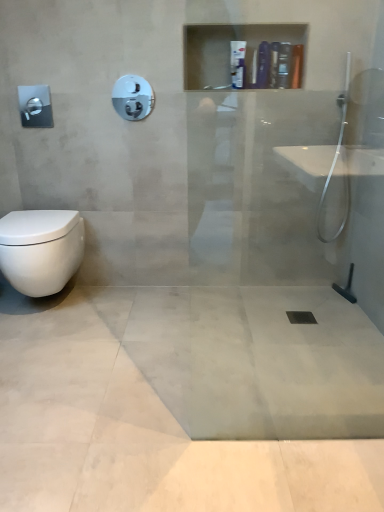
What do you see at coordinates (263, 65) in the screenshot?
I see `matte plastic bottle at upper center, the third toiletry when ordered from left to right` at bounding box center [263, 65].

Image resolution: width=384 pixels, height=512 pixels. What do you see at coordinates (284, 65) in the screenshot? I see `matte black soap dispenser at upper center, which ranks as the second toiletry in right-to-left order` at bounding box center [284, 65].

Describe the element at coordinates (217, 87) in the screenshot. The image size is (384, 512). I see `white glossy towel bar at upper center, positioned as the first towel bar in top-to-bottom order` at that location.

I want to click on white glossy towel bar at upper center, positioned as the first towel bar in top-to-bottom order, so click(x=217, y=87).

The width and height of the screenshot is (384, 512). Find the location of `silver metallic towel bar at upper left, which is counted as the first towel bar, starting from the bottom`. silver metallic towel bar at upper left, which is counted as the first towel bar, starting from the bottom is located at coordinates (35, 106).

Measure the distance between point [239,57] and camera.

Point [239,57] is 3.53 feet from camera.

At what (x,y) coordinates should I click in order to perform the action: click on satin nickel showerhead at upper left. Please return your answer as a coordinate pair (x, y). Looking at the image, I should click on (133, 97).

The image size is (384, 512). What do you see at coordinates (143, 434) in the screenshot? I see `light gray concrete at center` at bounding box center [143, 434].

Where is `matte plastic bottle at upper center, the third toiletry when ordered from left to right`? matte plastic bottle at upper center, the third toiletry when ordered from left to right is located at coordinates (263, 65).

Based on the photo, between white glossy towel bar at upper center, which appears as the 2th towel bar when ordered from the bottom, and matte black soap dispenser at upper center, arranged as the 4th toiletry when viewed from the left, which one has larger size?

matte black soap dispenser at upper center, arranged as the 4th toiletry when viewed from the left.

Identify the location of towel bar that is the 2nd one when counting backward from the matte black soap dispenser at upper center, which ranks as the second toiletry in right-to-left order. The image size is (384, 512). (217, 87).

How different are the orientations of white glossy towel bar at upper center, positioned as the first towel bar in top-to-bottom order, and matte black soap dispenser at upper center, which ranks as the second toiletry in right-to-left order, in degrees?

The facing directions of white glossy towel bar at upper center, positioned as the first towel bar in top-to-bottom order, and matte black soap dispenser at upper center, which ranks as the second toiletry in right-to-left order, are 0.455 degrees apart.

How far apart are white glossy towel bar at upper center, which appears as the 2th towel bar when viewed from the left, and matte black soap dispenser at upper center, which ranks as the second toiletry in right-to-left order?

white glossy towel bar at upper center, which appears as the 2th towel bar when viewed from the left, and matte black soap dispenser at upper center, which ranks as the second toiletry in right-to-left order, are 1.16 meters apart.

Does white glossy bottle at upper center, which appears as the 1th toiletry when viewed from the left, have a smaller size compared to light gray concrete at center?

Indeed, white glossy bottle at upper center, which appears as the 1th toiletry when viewed from the left, has a smaller size compared to light gray concrete at center.

Is white glossy bottle at upper center, which appears as the 5th toiletry when viewed from the right, facing away from light gray concrete at center?

white glossy bottle at upper center, which appears as the 5th toiletry when viewed from the right, is not turned away from light gray concrete at center.

What's the angular difference between white glossy bottle at upper center, which appears as the 5th toiletry when viewed from the right, and light gray concrete at center's facing directions?

The angular difference between white glossy bottle at upper center, which appears as the 5th toiletry when viewed from the right, and light gray concrete at center is 90.9 degrees.

Is light gray concrete at center a part of white glossy bottle at upper center, which appears as the 1th toiletry when viewed from the left?

No, light gray concrete at center is not surrounded by white glossy bottle at upper center, which appears as the 1th toiletry when viewed from the left.

Would you say satin nickel showerhead at upper left is part of white glossy bottle at upper center, which is counted as the 2th toiletry, starting from the left,'s contents?

No, satin nickel showerhead at upper left is not surrounded by white glossy bottle at upper center, which is counted as the 2th toiletry, starting from the left.

Between white glossy bottle at upper center, which is counted as the 2th toiletry, starting from the left, and satin nickel showerhead at upper left, which one has smaller size?

satin nickel showerhead at upper left is smaller.

Is white glossy bottle at upper center, which appears as the 5th toiletry when viewed from the right, thinner than white glossy bottle at upper center, which is counted as the 2th toiletry, starting from the left?

Yes, white glossy bottle at upper center, which appears as the 5th toiletry when viewed from the right, is thinner than white glossy bottle at upper center, which is counted as the 2th toiletry, starting from the left.

Is white glossy bottle at upper center, which appears as the 1th toiletry when viewed from the left, outside of white glossy bottle at upper center, the 4th toiletry in the right-to-left sequence?

white glossy bottle at upper center, which appears as the 1th toiletry when viewed from the left, lies outside white glossy bottle at upper center, the 4th toiletry in the right-to-left sequence,'s area.

Consider the image. Which of these two, white glossy bottle at upper center, which appears as the 1th toiletry when viewed from the left, or white glossy bottle at upper center, the 4th toiletry in the right-to-left sequence, stands shorter?

white glossy bottle at upper center, the 4th toiletry in the right-to-left sequence, is shorter.

Are white glossy bottle at upper center, which appears as the 5th toiletry when viewed from the right, and white glossy bottle at upper center, the 4th toiletry in the right-to-left sequence, located far from each other?

white glossy bottle at upper center, which appears as the 5th toiletry when viewed from the right, is near white glossy bottle at upper center, the 4th toiletry in the right-to-left sequence, not far away.

Is the depth of light gray concrete at center less than that of black rubber drain at center?

Yes, it is in front of black rubber drain at center.

Is black rubber drain at center completely or partially inside light gray concrete at center?

Absolutely, black rubber drain at center is inside light gray concrete at center.

Which of these two, light gray concrete at center or black rubber drain at center, is wider?

light gray concrete at center is wider.

How different are the orientations of light gray concrete at center and black rubber drain at center in degrees?

1.1 degrees separate the facing orientations of light gray concrete at center and black rubber drain at center.

Is matte orange tube at upper center, the 5th toiletry when ordered from left to right, bigger or smaller than light gray concrete at center?

Clearly, matte orange tube at upper center, the 5th toiletry when ordered from left to right, is smaller in size than light gray concrete at center.

From a real-world perspective, is matte orange tube at upper center, which appears as the first toiletry when viewed from the right, positioned above or below light gray concrete at center?

matte orange tube at upper center, which appears as the first toiletry when viewed from the right, is situated higher than light gray concrete at center in the real world.

What's the angular difference between matte orange tube at upper center, which appears as the first toiletry when viewed from the right, and light gray concrete at center's facing directions?

91.3 degrees.

From the image's perspective, who appears lower, matte orange tube at upper center, which appears as the first toiletry when viewed from the right, or light gray concrete at center?

light gray concrete at center is shown below in the image.

From a real-world perspective, is silver metallic towel bar at upper left, which is the second towel bar from top to bottom, on matte plastic bottle at upper center, the 3th toiletry positioned from the right?

Incorrect, from a real-world perspective, silver metallic towel bar at upper left, which is the second towel bar from top to bottom, is lower than matte plastic bottle at upper center, the 3th toiletry positioned from the right.

Can you confirm if silver metallic towel bar at upper left, which is counted as the first towel bar, starting from the bottom, is wider than matte plastic bottle at upper center, the third toiletry when ordered from left to right?

In fact, silver metallic towel bar at upper left, which is counted as the first towel bar, starting from the bottom, might be narrower than matte plastic bottle at upper center, the third toiletry when ordered from left to right.

Which is more to the right, silver metallic towel bar at upper left, which is the second towel bar from top to bottom, or matte plastic bottle at upper center, the 3th toiletry positioned from the right?

matte plastic bottle at upper center, the 3th toiletry positioned from the right.

Would you say silver metallic towel bar at upper left, the 1th towel bar when ordered from left to right, is inside or outside matte plastic bottle at upper center, the third toiletry when ordered from left to right?

silver metallic towel bar at upper left, the 1th towel bar when ordered from left to right, is located beyond the bounds of matte plastic bottle at upper center, the third toiletry when ordered from left to right.

Locate an element on the screen. This screenshot has height=512, width=384. towel bar that is the 1st object to the left of the matte black soap dispenser at upper center, which ranks as the second toiletry in right-to-left order, starting at the anchor is located at coordinates (217, 87).

The image size is (384, 512). Find the location of `the 1st toiletry counting from the right side of the light gray concrete at center`. the 1st toiletry counting from the right side of the light gray concrete at center is located at coordinates (238, 64).

Considering their positions, is black rubber drain at center positioned further to satin nickel showerhead at upper left than white glossy bottle at upper center, the 4th toiletry in the right-to-left sequence?

black rubber drain at center is positioned further to the anchor satin nickel showerhead at upper left.

Considering their positions, is white glossy toilet at lower left positioned further to matte plastic bottle at upper center, the 3th toiletry positioned from the right, than white glossy bottle at upper center, which appears as the 5th toiletry when viewed from the right?

white glossy toilet at lower left is further to matte plastic bottle at upper center, the 3th toiletry positioned from the right.

Considering their positions, is white glossy bottle at upper center, which is counted as the 2th toiletry, starting from the left, positioned closer to silver metallic towel bar at upper left, which is the second towel bar from top to bottom, than white glossy bottle at upper center, which appears as the 1th toiletry when viewed from the left?

white glossy bottle at upper center, which is counted as the 2th toiletry, starting from the left, lies closer to silver metallic towel bar at upper left, which is the second towel bar from top to bottom, than the other object.

Which object lies further to the anchor point satin nickel showerhead at upper left, white glossy toilet at lower left or white glossy bottle at upper center, which appears as the 1th toiletry when viewed from the left?

white glossy bottle at upper center, which appears as the 1th toiletry when viewed from the left, is positioned further to the anchor satin nickel showerhead at upper left.

Looking at the image, which one is located closer to black rubber drain at center, silver metallic towel bar at upper left, which is counted as the first towel bar, starting from the bottom, or white glossy towel bar at upper center, which appears as the 2th towel bar when viewed from the left?

The object closer to black rubber drain at center is white glossy towel bar at upper center, which appears as the 2th towel bar when viewed from the left.

From the image, which object appears to be farther from black rubber drain at center, satin nickel showerhead at upper left or white glossy towel bar at upper center, positioned as the first towel bar in top-to-bottom order?

The object further to black rubber drain at center is white glossy towel bar at upper center, positioned as the first towel bar in top-to-bottom order.

Based on their spatial positions, is silver metallic towel bar at upper left, which is the second towel bar from top to bottom, or satin nickel showerhead at upper left closer to light gray concrete at center?

satin nickel showerhead at upper left is closer to light gray concrete at center.

Which object lies nearer to the anchor point satin nickel showerhead at upper left, matte plastic bottle at upper center, the third toiletry when ordered from left to right, or white glossy bottle at upper center, the 4th toiletry in the right-to-left sequence?

matte plastic bottle at upper center, the third toiletry when ordered from left to right, is positioned closer to the anchor satin nickel showerhead at upper left.

The height and width of the screenshot is (512, 384). In order to click on toilet located between silver metallic towel bar at upper left, which is the second towel bar from top to bottom, and matte orange tube at upper center, the 5th toiletry when ordered from left to right, in the left-right direction in this screenshot , I will do `click(41, 249)`.

Identify the location of shower that lies between white glossy bottle at upper center, the 4th toiletry in the right-to-left sequence, and light gray concrete at center from top to bottom. This screenshot has height=512, width=384. (133, 97).

The image size is (384, 512). What are the coordinates of `shower between white glossy toilet at lower left and white glossy bottle at upper center, the 4th toiletry in the right-to-left sequence, in the horizontal direction` in the screenshot? It's located at (x=133, y=97).

Find the location of a particular element. Image resolution: width=384 pixels, height=512 pixels. shower between matte orange tube at upper center, the 5th toiletry when ordered from left to right, and light gray concrete at center, in the vertical direction is located at coordinates (133, 97).